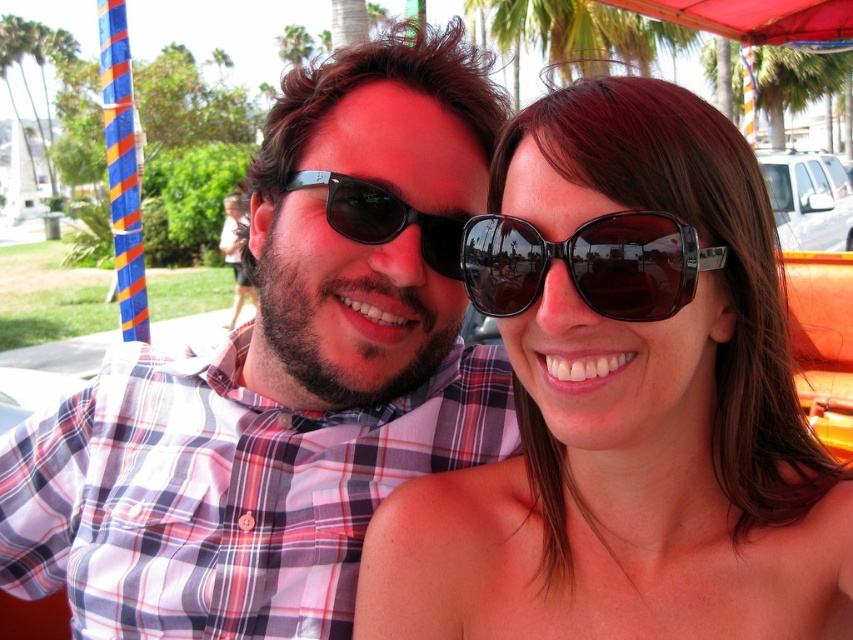
Can you confirm if plaid shirt at center is positioned to the left of black plastic sunglasses at center?

Yes, plaid shirt at center is to the left of black plastic sunglasses at center.

Describe the element at coordinates (283, 376) in the screenshot. I see `plaid shirt at center` at that location.

This screenshot has width=853, height=640. I want to click on plaid shirt at center, so click(x=283, y=376).

Who is lower down, plaid shirt at center or black reflective sunglasses at upper center?

plaid shirt at center

The width and height of the screenshot is (853, 640). What do you see at coordinates (283, 376) in the screenshot?
I see `plaid shirt at center` at bounding box center [283, 376].

You are a GUI agent. You are given a task and a screenshot of the screen. Output one action in this format:
    pyautogui.click(x=<x>, y=<y>)
    Task: Click on the plaid shirt at center
    The height and width of the screenshot is (640, 853).
    Given the screenshot: What is the action you would take?
    pyautogui.click(x=283, y=376)

Can you confirm if matte black sunglasses at center is positioned below black plastic sunglasses at center?

Correct, matte black sunglasses at center is located below black plastic sunglasses at center.

Can you confirm if matte black sunglasses at center is positioned to the right of black plastic sunglasses at center?

Indeed, matte black sunglasses at center is positioned on the right side of black plastic sunglasses at center.

You are a GUI agent. You are given a task and a screenshot of the screen. Output one action in this format:
    pyautogui.click(x=<x>, y=<y>)
    Task: Click on the matte black sunglasses at center
    
    Given the screenshot: What is the action you would take?
    pyautogui.click(x=624, y=401)